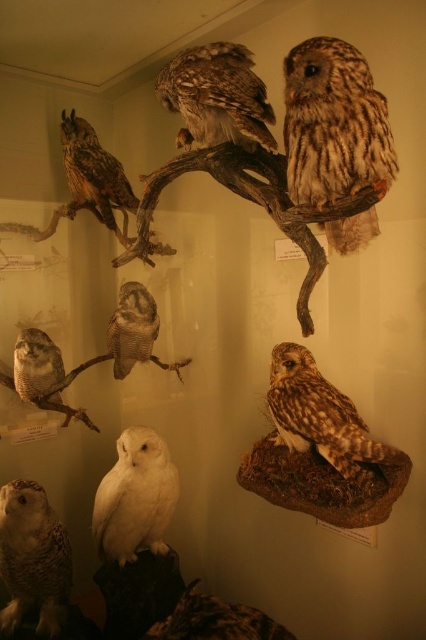
Does brown speckled feathers at center have a greater height compared to speckled white owl at lower left?

No, brown speckled feathers at center is not taller than speckled white owl at lower left.

Is brown speckled feathers at center below speckled white owl at lower left?

Actually, brown speckled feathers at center is above speckled white owl at lower left.

Identify the location of brown speckled feathers at center. This screenshot has width=426, height=640. (321, 416).

Image resolution: width=426 pixels, height=640 pixels. I want to click on brown speckled feathers at upper center, so click(216, 97).

Which is behind, point (184, 72) or point (100, 172)?

Point (100, 172)

You are a GUI agent. You are given a task and a screenshot of the screen. Output one action in this format:
    pyautogui.click(x=<x>, y=<y>)
    Task: Click on the brown speckled feathers at upper center
    
    Given the screenshot: What is the action you would take?
    pyautogui.click(x=216, y=97)

Can you confirm if brown speckled feathers at center is positioned to the right of white feathered owl at lower left?

Indeed, brown speckled feathers at center is positioned on the right side of white feathered owl at lower left.

Can you confirm if brown speckled feathers at center is bigger than white feathered owl at lower left?

Yes.

Locate an element on the screen. The width and height of the screenshot is (426, 640). brown speckled feathers at center is located at coordinates (321, 416).

Image resolution: width=426 pixels, height=640 pixels. Find the location of `brown speckled feathers at center`. brown speckled feathers at center is located at coordinates (321, 416).